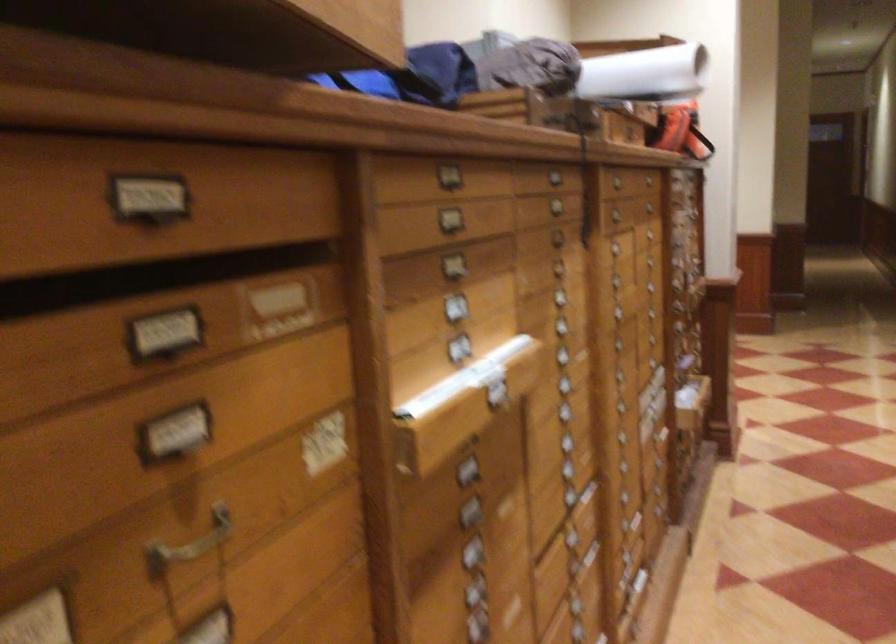
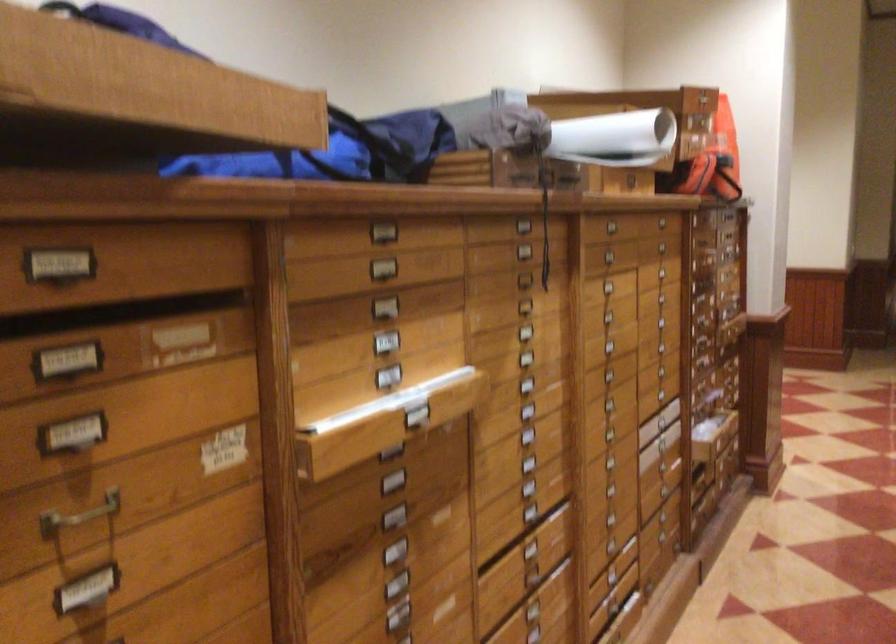
The point at (495, 384) is marked in the first image. Where is the corresponding point in the second image?

(416, 411)